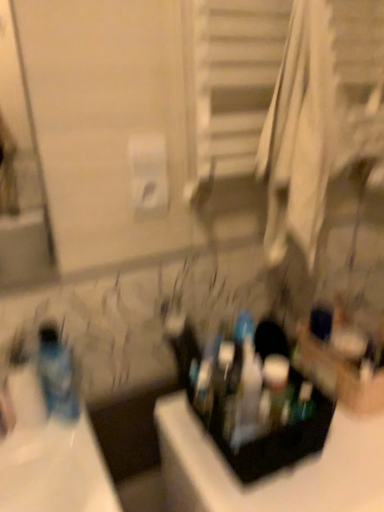
Question: Is black plastic container at center located outside translucent plastic toothbrush at center?

Choices:
 (A) no
 (B) yes

Answer: (B)

Question: Does black plastic container at center have a lesser height compared to translucent plastic toothbrush at center?

Choices:
 (A) yes
 (B) no

Answer: (B)

Question: Is black plastic container at center thinner than translucent plastic toothbrush at center?

Choices:
 (A) yes
 (B) no

Answer: (B)

Question: Considering the relative positions of black plastic container at center and translucent plastic toothbrush at center in the image provided, is black plastic container at center in front of translucent plastic toothbrush at center?

Choices:
 (A) yes
 (B) no

Answer: (A)

Question: Can you confirm if black plastic container at center is smaller than translucent plastic toothbrush at center?

Choices:
 (A) yes
 (B) no

Answer: (B)

Question: Is black plastic container at center at the left side of translucent plastic toothbrush at center?

Choices:
 (A) no
 (B) yes

Answer: (A)

Question: From a real-world perspective, is black plastic container at center below translucent plastic bottle at left?

Choices:
 (A) no
 (B) yes

Answer: (B)

Question: Considering the relative sizes of black plastic container at center and translucent plastic bottle at left in the image provided, is black plastic container at center wider than translucent plastic bottle at left?

Choices:
 (A) yes
 (B) no

Answer: (A)

Question: Is black plastic container at center to the right of translucent plastic bottle at left from the viewer's perspective?

Choices:
 (A) yes
 (B) no

Answer: (A)

Question: Can you confirm if black plastic container at center is thinner than translucent plastic bottle at left?

Choices:
 (A) yes
 (B) no

Answer: (B)

Question: From the image's perspective, is black plastic container at center on translucent plastic bottle at left?

Choices:
 (A) yes
 (B) no

Answer: (B)

Question: Does black plastic container at center have a lesser height compared to translucent plastic bottle at left?

Choices:
 (A) no
 (B) yes

Answer: (A)

Question: Is translucent plastic bottle at left in contact with black plastic container at center?

Choices:
 (A) yes
 (B) no

Answer: (B)